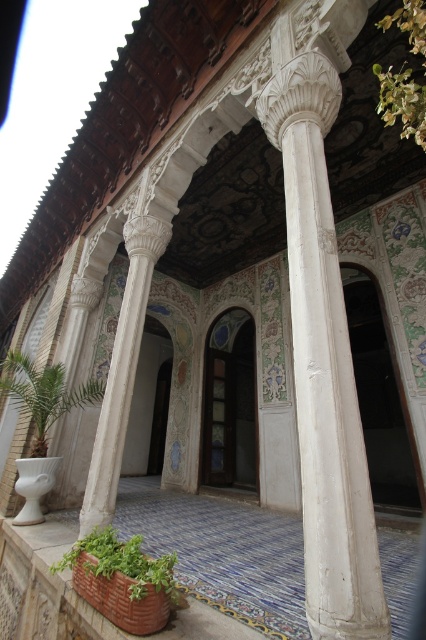
You are standing in the courtyard and want to place a small statue between the two points labeled point (25, 632) and point (37, 381). Which point should the statue be closer to so it is in front of the other point?

The statue should be closer to point (25, 632) because it is in front of point (37, 381).

You are a gardener who wants to move the terracotta clay pot at lower center and the green leafy plant at lower left to a new location. You have a cart that can carry items up to 1 meter in width. Which of the two items requires more space on the cart?

The green leafy plant at lower left requires more space on the cart because it has a greater width than the terracotta clay pot at lower center according to the description.